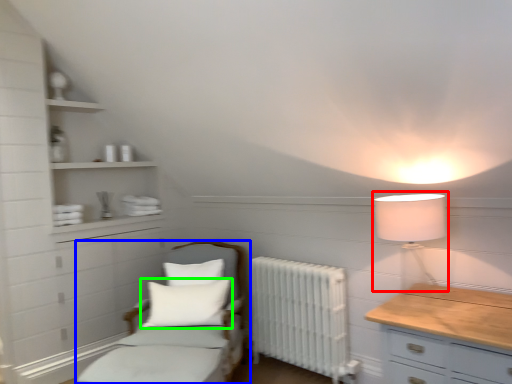
Question: Estimate the real-world distances between objects in this image. Which object is closer to table lamp (highlighted by a red box), furniture (highlighted by a blue box) or pillow (highlighted by a green box)?

Choices:
 (A) furniture
 (B) pillow

Answer: (A)